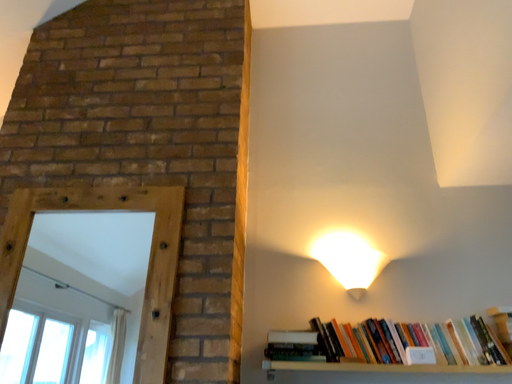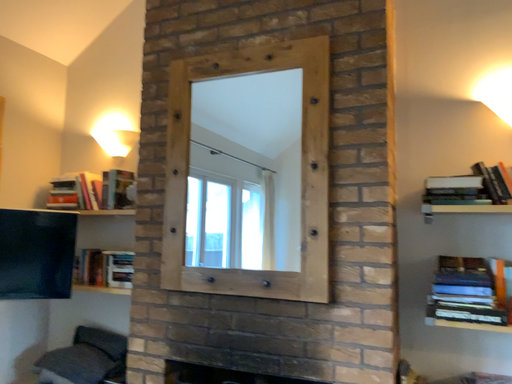
Question: Which way did the camera rotate in the video?

Choices:
 (A) rotated right
 (B) rotated left

Answer: (B)